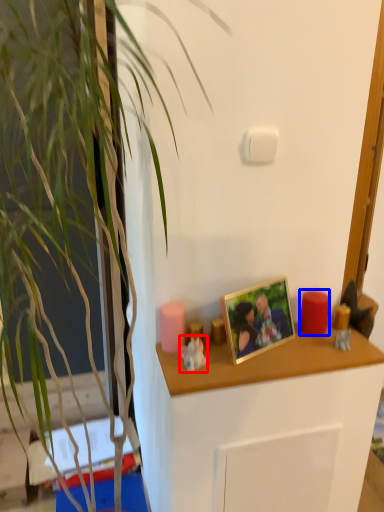
Question: Among these objects, which one is farthest to the camera, toy (highlighted by a red box) or candle (highlighted by a blue box)?

Choices:
 (A) toy
 (B) candle

Answer: (B)